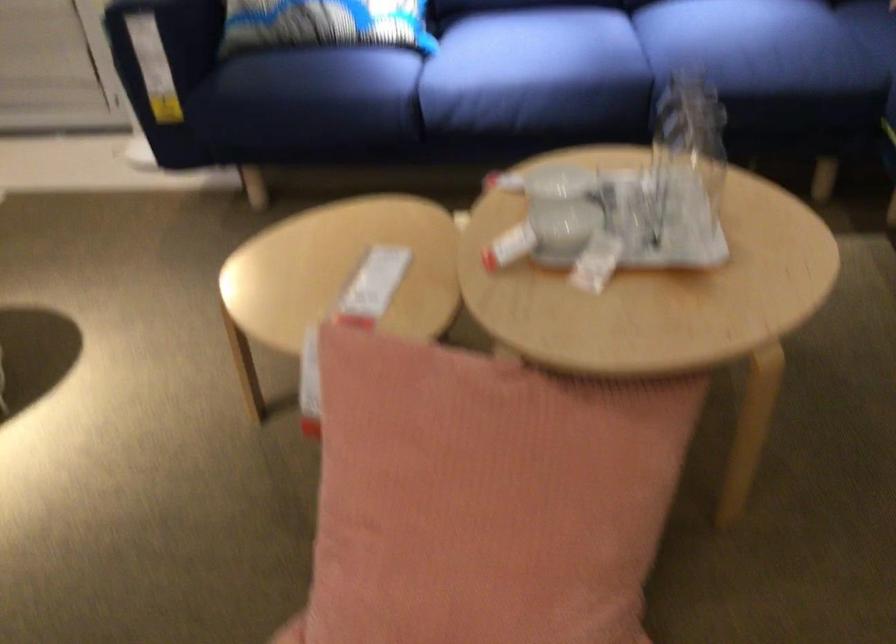
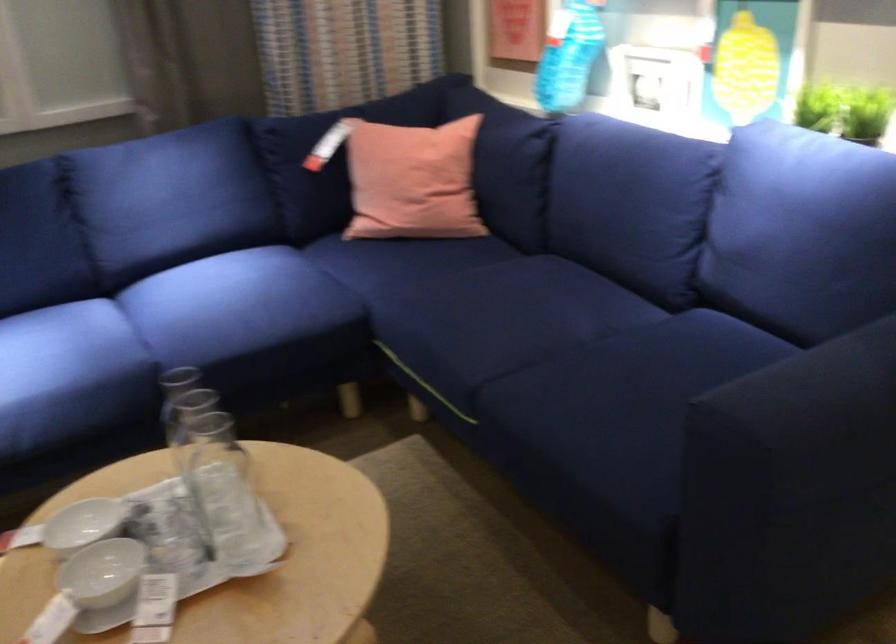
The point at (667,196) is marked in the first image. Where is the corresponding point in the second image?

(222, 491)